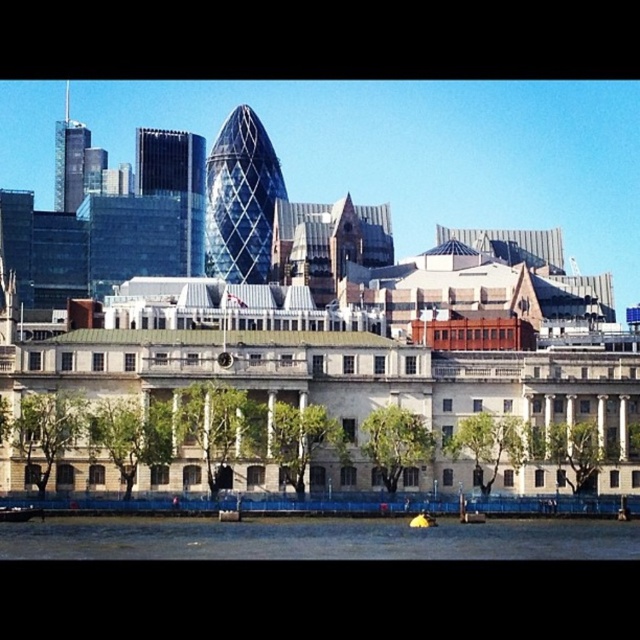
Can you confirm if yellow rubber boat at lower left is positioned below yellow rubber boat at lower center?

No.

Can you confirm if yellow rubber boat at lower left is positioned to the right of yellow rubber boat at lower center?

Incorrect, yellow rubber boat at lower left is not on the right side of yellow rubber boat at lower center.

Is point (22, 518) farther from camera compared to point (417, 516)?

No, it is in front of (417, 516).

I want to click on yellow rubber boat at lower left, so click(x=19, y=513).

Is dark blue water at lower center below yellow rubber boat at lower center?

Yes.

How far apart are dark blue water at lower center and yellow rubber boat at lower center?

dark blue water at lower center and yellow rubber boat at lower center are 11.13 meters apart from each other.

Is point (192, 547) farther from viewer compared to point (413, 518)?

That is False.

Identify the location of dark blue water at lower center. (317, 540).

Between dark blue water at lower center and yellow rubber boat at lower left, which one appears on the left side from the viewer's perspective?

Positioned to the left is yellow rubber boat at lower left.

Can you confirm if dark blue water at lower center is positioned to the right of yellow rubber boat at lower left?

Indeed, dark blue water at lower center is positioned on the right side of yellow rubber boat at lower left.

What do you see at coordinates (317, 540) in the screenshot? I see `dark blue water at lower center` at bounding box center [317, 540].

The width and height of the screenshot is (640, 640). I want to click on dark blue water at lower center, so click(317, 540).